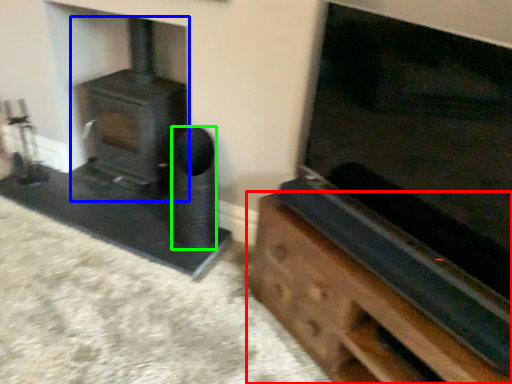
Question: Which object is the closest to the furniture (highlighted by a red box)? Choose among these: wood burning stove (highlighted by a blue box) or speaker (highlighted by a green box).

Choices:
 (A) wood burning stove
 (B) speaker

Answer: (B)